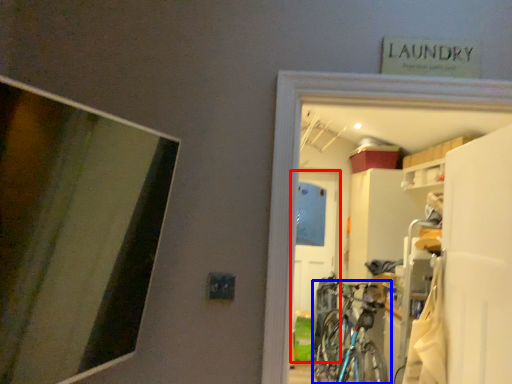
Question: Which point is further to the camera, door (highlighted by a red box) or bicycle (highlighted by a blue box)?

Choices:
 (A) door
 (B) bicycle

Answer: (A)